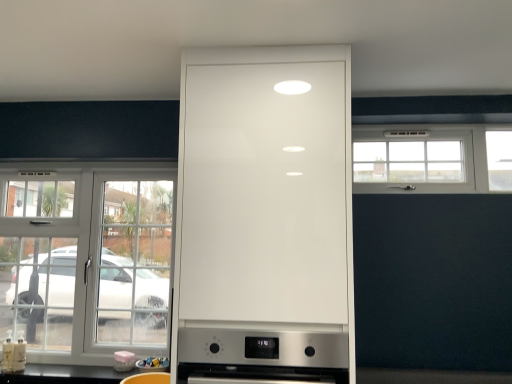
Question: In which direction should I rotate to look at matte plastic container at lower center, arranged as the second appliance when viewed from the left?

Choices:
 (A) left
 (B) right

Answer: (A)

Question: Is white glossy cup at lower center, which is counted as the second appliance, starting from the right, wider than stainless steel oven at center?

Choices:
 (A) yes
 (B) no

Answer: (B)

Question: Does white glossy cup at lower center, which is counted as the second appliance, starting from the right, contain stainless steel oven at center?

Choices:
 (A) yes
 (B) no

Answer: (B)

Question: Considering the relative positions of white glossy cup at lower center, which is counted as the second appliance, starting from the right, and stainless steel oven at center in the image provided, is white glossy cup at lower center, which is counted as the second appliance, starting from the right, to the left of stainless steel oven at center from the viewer's perspective?

Choices:
 (A) no
 (B) yes

Answer: (B)

Question: Is the depth of white glossy cup at lower center, positioned as the first appliance in left-to-right order, less than that of stainless steel oven at center?

Choices:
 (A) yes
 (B) no

Answer: (B)

Question: Is white glossy cup at lower center, which is counted as the second appliance, starting from the right, not near stainless steel oven at center?

Choices:
 (A) no
 (B) yes

Answer: (A)

Question: Is white glossy cup at lower center, which is counted as the second appliance, starting from the right, smaller than stainless steel oven at center?

Choices:
 (A) no
 (B) yes

Answer: (B)

Question: Is white glossy cabinet at center next to stainless steel oven at center?

Choices:
 (A) yes
 (B) no

Answer: (B)

Question: Is white glossy cabinet at center positioned with its back to stainless steel oven at center?

Choices:
 (A) yes
 (B) no

Answer: (A)

Question: From a real-world perspective, is white glossy cabinet at center under stainless steel oven at center?

Choices:
 (A) yes
 (B) no

Answer: (B)

Question: Are white glossy cabinet at center and stainless steel oven at center located far from each other?

Choices:
 (A) yes
 (B) no

Answer: (B)

Question: From the image's perspective, would you say white glossy cabinet at center is shown under stainless steel oven at center?

Choices:
 (A) yes
 (B) no

Answer: (B)

Question: Can you confirm if white glossy cabinet at center is bigger than stainless steel oven at center?

Choices:
 (A) no
 (B) yes

Answer: (B)

Question: Does white glass window at left, the 1th window ordered from the bottom, lie behind matte plastic container at lower center, arranged as the second appliance when viewed from the left?

Choices:
 (A) no
 (B) yes

Answer: (B)